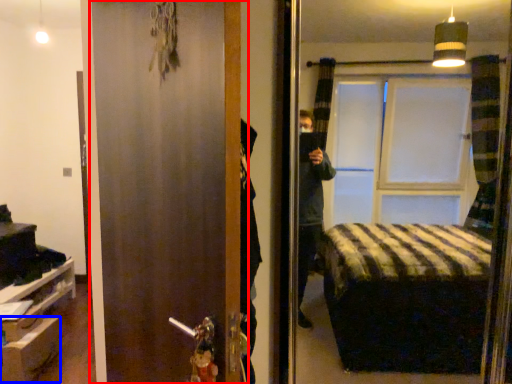
Question: Which object appears closest to the camera in this image, door (highlighted by a red box) or drawer (highlighted by a blue box)?

Choices:
 (A) door
 (B) drawer

Answer: (A)